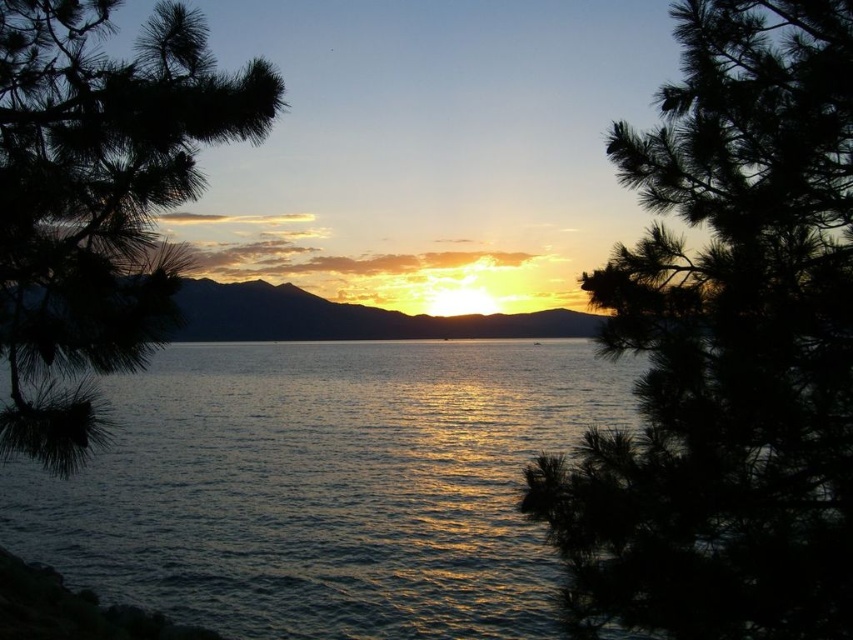
Is the position of dark green pine tree at center less distant than that of glistening silver water at center?

Yes, it is in front of glistening silver water at center.

Is dark green pine tree at center further to camera compared to glistening silver water at center?

No, it is not.

Locate an element on the screen. This screenshot has width=853, height=640. dark green pine tree at center is located at coordinates (726, 348).

Between glistening silver water at center and green matte pine branch at left, which one has more height?

glistening silver water at center

Is glistening silver water at center shorter than green matte pine branch at left?

In fact, glistening silver water at center may be taller than green matte pine branch at left.

Between point (207, 392) and point (180, 129), which one is positioned behind?

The point (207, 392) is behind.

This screenshot has width=853, height=640. I want to click on glistening silver water at center, so click(x=325, y=486).

Can you confirm if dark green pine tree at center is bigger than green matte pine branch at left?

Yes.

Does dark green pine tree at center appear under green matte pine branch at left?

Answer: Yes, dark green pine tree at center is below green matte pine branch at left.

Describe the element at coordinates (726, 348) in the screenshot. This screenshot has width=853, height=640. I see `dark green pine tree at center` at that location.

At what (x,y) coordinates should I click in order to perform the action: click on dark green pine tree at center. Please return your answer as a coordinate pair (x, y). Looking at the image, I should click on (726, 348).